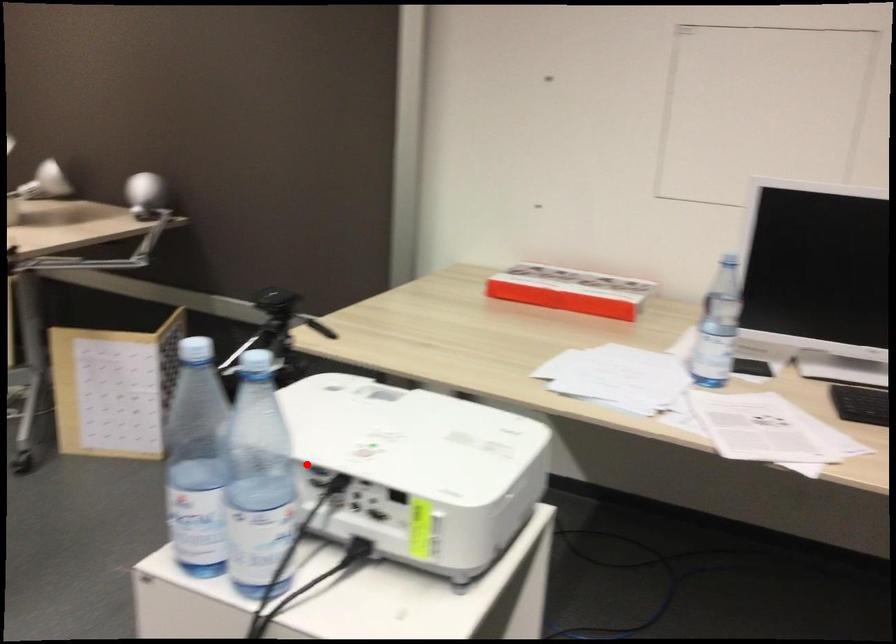
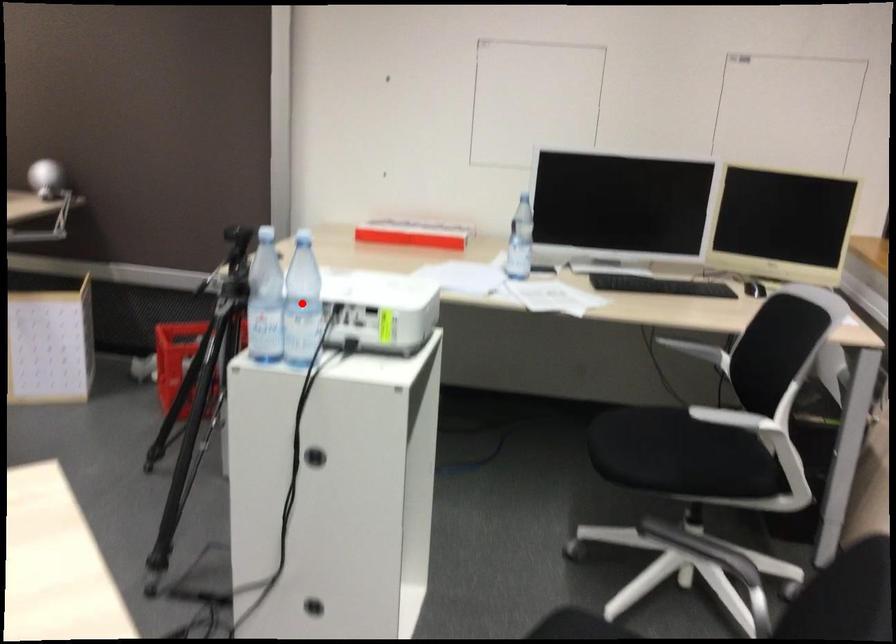
I am providing you with two images of the same scene from different viewpoints. A red point is marked on the first image and another point is marked on the second image. Does the point marked in image1 correspond to the same location as the one in image2?

Yes